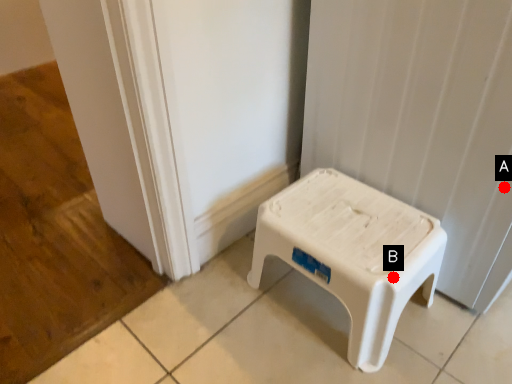
Question: Two points are circled on the image, labeled by A and B beside each circle. Which point is farther to the camera?

Choices:
 (A) A is further
 (B) B is further

Answer: (A)